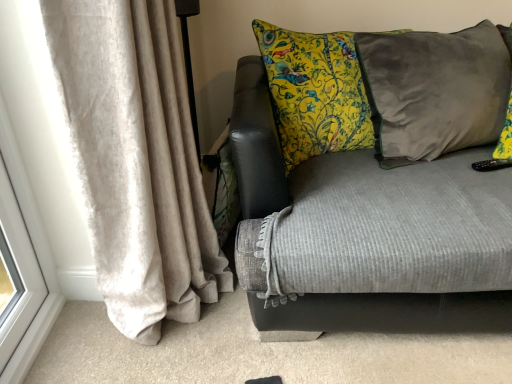
Describe the element at coordinates (434, 90) in the screenshot. The image size is (512, 384). I see `velvet gray pillow at right` at that location.

This screenshot has width=512, height=384. What do you see at coordinates (383, 197) in the screenshot? I see `velvet gray couch at center` at bounding box center [383, 197].

The height and width of the screenshot is (384, 512). I want to click on velvet gray pillow at right, so click(434, 90).

Between beige velvet curtain at left and velvet gray couch at center, which one has smaller width?

beige velvet curtain at left.

Visually, is beige velvet curtain at left positioned to the left or to the right of velvet gray couch at center?

beige velvet curtain at left is positioned on velvet gray couch at center's left side.

Find the location of a particular element. studio couch that is on the right side of beige velvet curtain at left is located at coordinates (383, 197).

Find the location of a particular element. This screenshot has height=384, width=512. curtain below the velvet gray pillow at right (from a real-world perspective) is located at coordinates (136, 160).

Is velvet gray pillow at right touching beige velvet curtain at left?

velvet gray pillow at right and beige velvet curtain at left are not in contact.

Is beige velvet curtain at left completely or partially inside velvet gray pillow at right?

That's incorrect, beige velvet curtain at left is not inside velvet gray pillow at right.

Looking at this image, how distant is velvet gray pillow at right from beige velvet curtain at left?

velvet gray pillow at right is 33.06 inches away from beige velvet curtain at left.

Is velvet gray couch at center shorter than beige velvet curtain at left?

Indeed, velvet gray couch at center has a lesser height compared to beige velvet curtain at left.

From a real-world perspective, is velvet gray couch at center above or below beige velvet curtain at left?

From a real-world perspective, velvet gray couch at center is physically below beige velvet curtain at left.

Is velvet gray couch at center further to the viewer compared to beige velvet curtain at left?

Yes, velvet gray couch at center is behind beige velvet curtain at left.

Does velvet gray couch at center appear on the left side of beige velvet curtain at left?

In fact, velvet gray couch at center is to the right of beige velvet curtain at left.

Based on the photo, from the image's perspective, would you say velvet gray couch at center is shown under velvet gray pillow at right?

Indeed, from the image's perspective, velvet gray couch at center is shown beneath velvet gray pillow at right.

Can you confirm if velvet gray couch at center is bigger than velvet gray pillow at right?

Yes, velvet gray couch at center is bigger than velvet gray pillow at right.

How distant is velvet gray couch at center from velvet gray pillow at right?

velvet gray couch at center is 6.55 inches from velvet gray pillow at right.

Can we say velvet gray couch at center lies outside velvet gray pillow at right?

That's correct, velvet gray couch at center is outside of velvet gray pillow at right.

Considering the sizes of objects beige velvet curtain at left and velvet gray pillow at right in the image provided, who is wider, beige velvet curtain at left or velvet gray pillow at right?

beige velvet curtain at left.

Are beige velvet curtain at left and velvet gray pillow at right beside each other?

No, beige velvet curtain at left is not beside velvet gray pillow at right.

Where is `curtain below the velvet gray pillow at right (from a real-world perspective)`? This screenshot has height=384, width=512. curtain below the velvet gray pillow at right (from a real-world perspective) is located at coordinates (136, 160).

Are velvet gray pillow at right and velvet gray couch at center making contact?

velvet gray pillow at right and velvet gray couch at center are not in contact.

Considering the positions of point (431, 141) and point (336, 183), is point (431, 141) closer or farther from the camera than point (336, 183)?

Point (431, 141).

Would you say velvet gray couch at center is part of velvet gray pillow at right's contents?

No, velvet gray couch at center is not inside velvet gray pillow at right.

You are a GUI agent. You are given a task and a screenshot of the screen. Output one action in this format:
    pyautogui.click(x=<x>, y=<y>)
    Task: Click on the pillow above the velvet gray couch at center (from the image's perspective)
    The image size is (512, 384).
    Given the screenshot: What is the action you would take?
    pyautogui.click(x=434, y=90)

The width and height of the screenshot is (512, 384). In order to click on studio couch beneath the beige velvet curtain at left (from a real-world perspective) in this screenshot , I will do [383, 197].

What are the coordinates of `pillow located above the beige velvet curtain at left (from a real-world perspective)` in the screenshot? It's located at (434, 90).

Based on their spatial positions, is beige velvet curtain at left or velvet gray pillow at right closer to velvet gray couch at center?

Among the two, velvet gray pillow at right is located nearer to velvet gray couch at center.

Based on their spatial positions, is velvet gray couch at center or velvet gray pillow at right closer to beige velvet curtain at left?

velvet gray couch at center lies closer to beige velvet curtain at left than the other object.

From the image, which object appears to be farther from beige velvet curtain at left, velvet gray pillow at right or velvet gray couch at center?

Among the two, velvet gray pillow at right is located further to beige velvet curtain at left.

Based on their spatial positions, is beige velvet curtain at left or velvet gray couch at center further from velvet gray pillow at right?

Among the two, beige velvet curtain at left is located further to velvet gray pillow at right.

Based on their spatial positions, is velvet gray pillow at right or beige velvet curtain at left closer to velvet gray couch at center?

velvet gray pillow at right.

From the image, which object appears to be nearer to velvet gray pillow at right, velvet gray couch at center or beige velvet curtain at left?

Among the two, velvet gray couch at center is located nearer to velvet gray pillow at right.

Image resolution: width=512 pixels, height=384 pixels. Find the location of `studio couch located between beige velvet curtain at left and velvet gray pillow at right in the left-right direction`. studio couch located between beige velvet curtain at left and velvet gray pillow at right in the left-right direction is located at coordinates (383, 197).